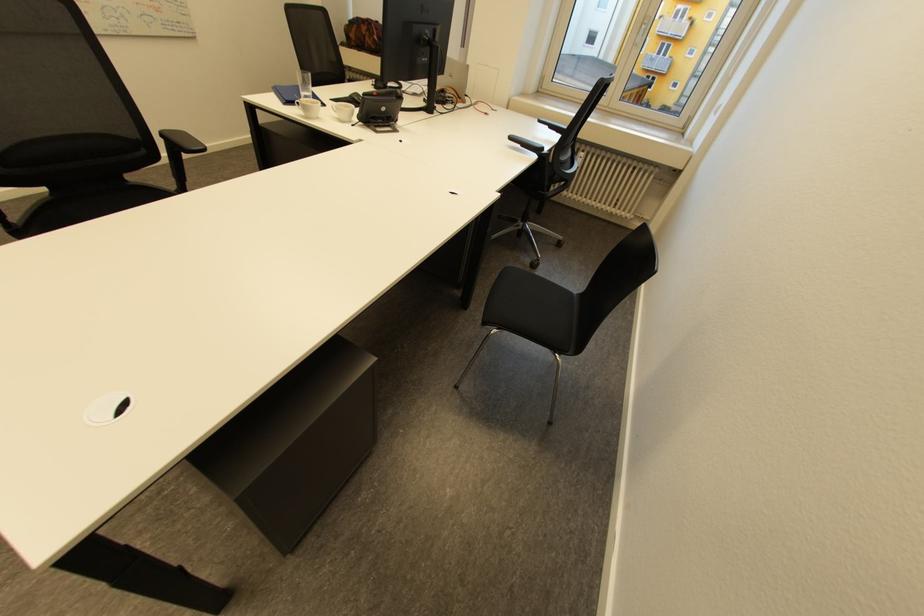
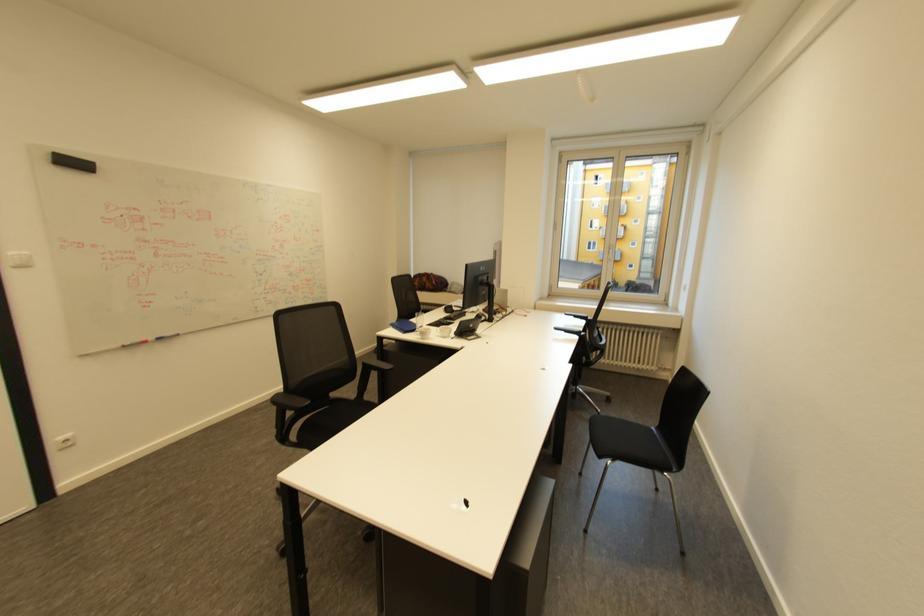
The point at (526,146) is marked in the first image. Where is the corresponding point in the second image?

(570, 333)